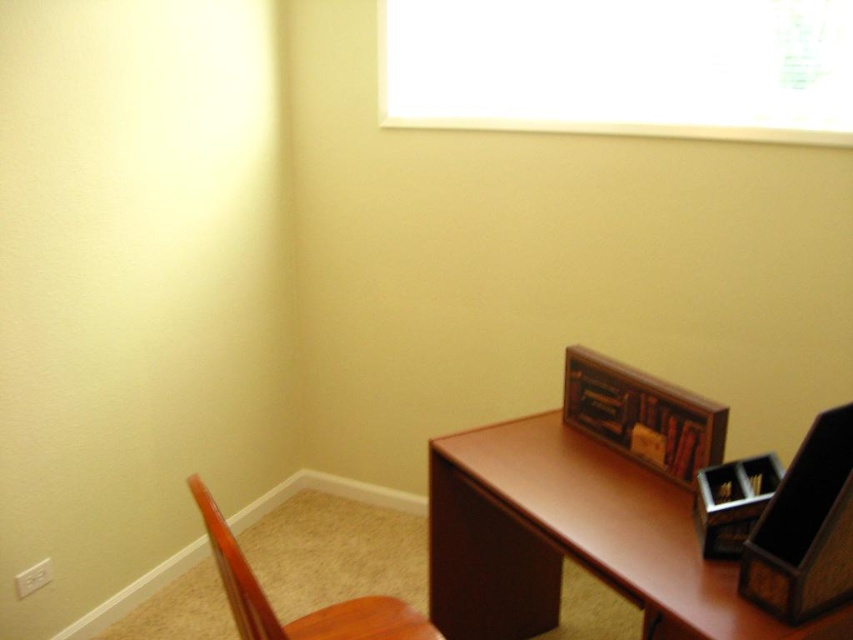
Image resolution: width=853 pixels, height=640 pixels. I want to click on brown wood computer desk at lower right, so click(573, 540).

Which is in front, point (466, 570) or point (363, 627)?

Point (363, 627) is in front.

Find the location of a particular element. This screenshot has height=640, width=853. brown wood computer desk at lower right is located at coordinates (573, 540).

You are a GUI agent. You are given a task and a screenshot of the screen. Output one action in this format:
    pyautogui.click(x=<x>, y=<y>)
    Task: Click on the brown wood computer desk at lower right
    
    Given the screenshot: What is the action you would take?
    pyautogui.click(x=573, y=540)

Between transparent glass window at upper center and wooden chair at lower left, which one is positioned higher?

transparent glass window at upper center

Is transparent glass window at upper center closer to the viewer compared to wooden chair at lower left?

No.

Where is `transparent glass window at upper center`? The height and width of the screenshot is (640, 853). transparent glass window at upper center is located at coordinates (621, 67).

Locate an element on the screen. The width and height of the screenshot is (853, 640). transparent glass window at upper center is located at coordinates (621, 67).

Can you confirm if transparent glass window at upper center is shorter than brown wood computer desk at lower right?

Indeed, transparent glass window at upper center has a lesser height compared to brown wood computer desk at lower right.

Based on the photo, can you confirm if transparent glass window at upper center is wider than brown wood computer desk at lower right?

Indeed, transparent glass window at upper center has a greater width compared to brown wood computer desk at lower right.

Measure the distance between transparent glass window at upper center and camera.

The distance of transparent glass window at upper center from camera is 1.96 meters.

In order to click on transparent glass window at upper center in this screenshot , I will do `click(621, 67)`.